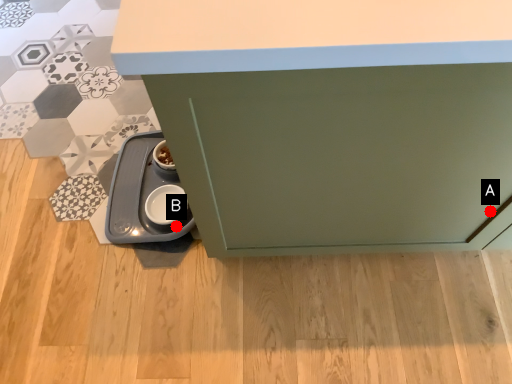
Question: Two points are circled on the image, labeled by A and B beside each circle. Which point is farther to the camera?

Choices:
 (A) A is further
 (B) B is further

Answer: (B)